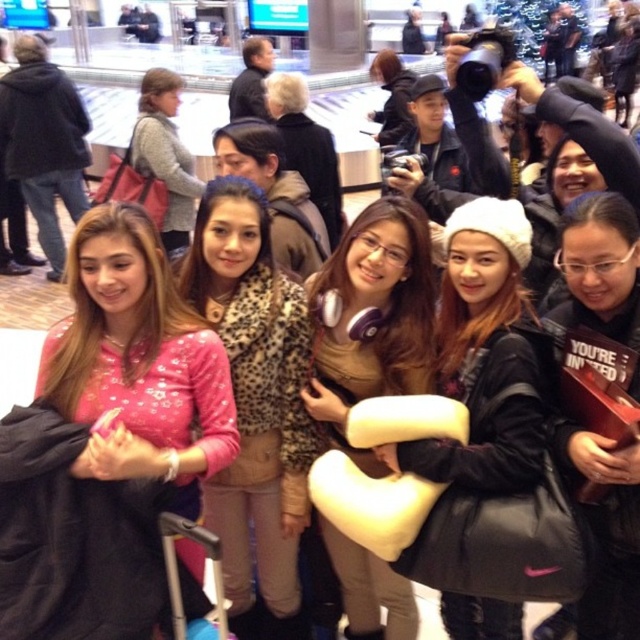
Who is taller, purple matte headphones at center or white matte beanie at center?

With more height is purple matte headphones at center.

Is purple matte headphones at center wider than white matte beanie at center?

No, purple matte headphones at center is not wider than white matte beanie at center.

Which is in front, point (420, 385) or point (506, 611)?

Point (506, 611) is in front.

Where is `purple matte headphones at center`? purple matte headphones at center is located at coordinates (371, 317).

In the scene shown: Who is higher up, pink satin blouse at center or white matte beanie at center?

white matte beanie at center is above.

Is pink satin blouse at center bigger than white matte beanie at center?

No, pink satin blouse at center is not bigger than white matte beanie at center.

Which is behind, point (156, 380) or point (468, 200)?

The point (468, 200) is more distant.

At what (x,y) coordinates should I click in order to perform the action: click on pink satin blouse at center. Please return your answer as a coordinate pair (x, y). This screenshot has height=640, width=640. Looking at the image, I should click on (138, 362).

Does white matte beanie at center have a lesser height compared to black matte jacket at center?

No, white matte beanie at center is not shorter than black matte jacket at center.

Does point (488, 600) lie behind point (554, 440)?

Yes.

Measure the distance between white matte beanie at center and camera.

white matte beanie at center and camera are 12.05 meters apart from each other.

Locate an element on the screen. white matte beanie at center is located at coordinates (483, 355).